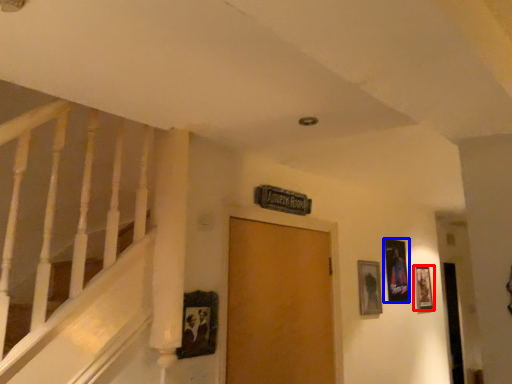
Question: Which object appears farthest to the camera in this image, picture frame (highlighted by a red box) or picture frame (highlighted by a blue box)?

Choices:
 (A) picture frame
 (B) picture frame

Answer: (A)